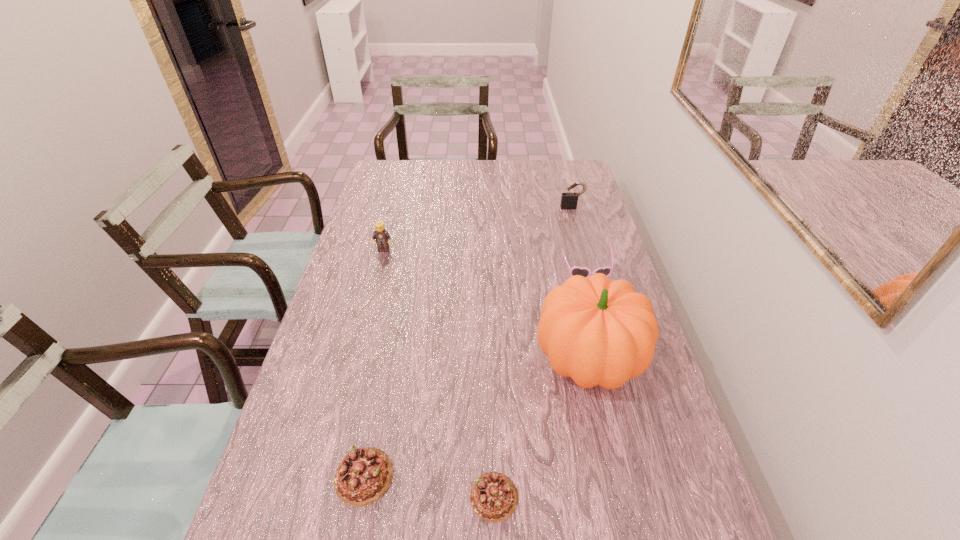
I want to click on the taller chocolate cake, so click(363, 476).

Identify the location of the shorter chocolate cake. This screenshot has width=960, height=540. (494, 497).

In order to click on the third object from left to right in this screenshot , I will do `click(494, 497)`.

Locate an element on the screen. Image resolution: width=960 pixels, height=540 pixels. the farthest object is located at coordinates (569, 200).

Image resolution: width=960 pixels, height=540 pixels. I want to click on the third farthest object, so click(586, 272).

The width and height of the screenshot is (960, 540). What are the coordinates of `the fifth nearest object` in the screenshot? It's located at (382, 237).

This screenshot has height=540, width=960. Identify the location of the third nearest object. (597, 331).

Where is `pumpkin`? pumpkin is located at coordinates (597, 331).

Locate an element on the screen. vacant region located 0.390m on the right of the taller chocolate cake is located at coordinates (579, 476).

Where is `free space located 0.300m on the right of the shorter chocolate cake`? The width and height of the screenshot is (960, 540). free space located 0.300m on the right of the shorter chocolate cake is located at coordinates (665, 496).